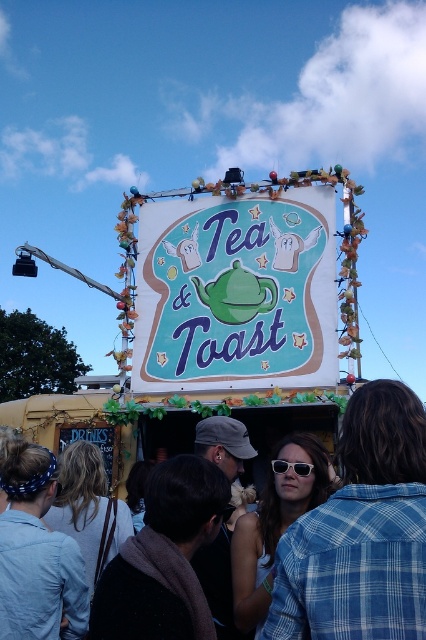
Does point (339, 522) lie in front of point (279, 474)?

Yes, point (339, 522) is in front of point (279, 474).

Is denim jacket at lower right smaller than white plastic sunglasses at center?

Actually, denim jacket at lower right might be larger than white plastic sunglasses at center.

This screenshot has height=640, width=426. I want to click on denim jacket at lower right, so click(362, 531).

Identify the location of teal fabric sign at center. Image resolution: width=426 pixels, height=640 pixels. (236, 292).

Between point (245, 333) and point (305, 465), which one is positioned behind?

The point (245, 333) is behind.

Find the location of a particular element. teal fabric sign at center is located at coordinates (236, 292).

Does teal fabric sign at center appear under denim jacket at lower right?

Incorrect, teal fabric sign at center is not positioned below denim jacket at lower right.

Who is more forward, (229,378) or (273,593)?

Point (273,593) is in front.

Is point (149, 225) positioned before point (314, 536)?

No, (149, 225) is behind (314, 536).

Where is `teal fabric sign at center`? Image resolution: width=426 pixels, height=640 pixels. teal fabric sign at center is located at coordinates (236, 292).